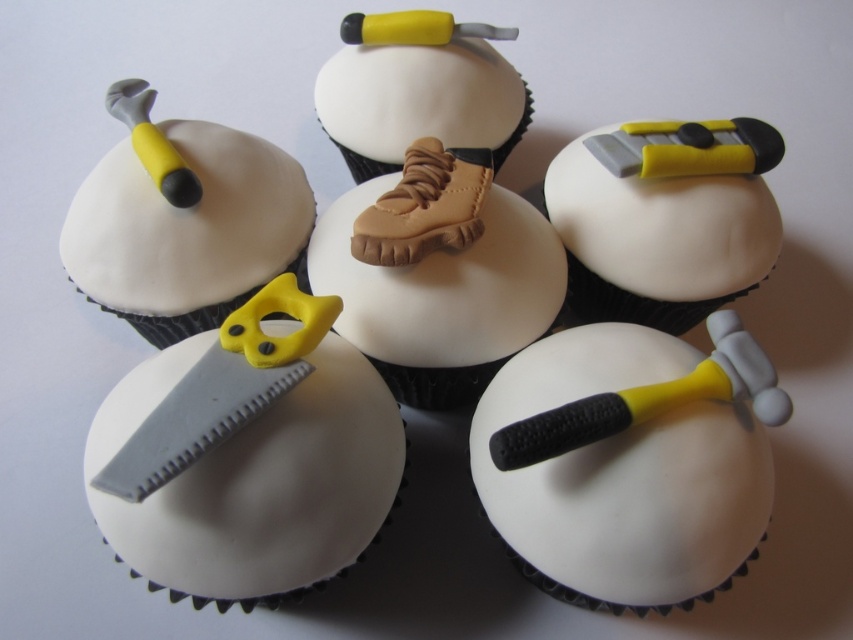
Question: Which object is positioned farthest from the gray matte saw at center?

Choices:
 (A) matte gray hammer at center
 (B) yellow matte hammer at lower right
 (C) matte white shoe at center

Answer: (A)

Question: Which point is farther from the camera taking this photo?

Choices:
 (A) (350, 524)
 (B) (113, 266)
 (C) (624, 384)

Answer: (B)

Question: Which of the following is the farthest from the observer?

Choices:
 (A) (392, 312)
 (B) (120, 280)

Answer: (B)

Question: Can you confirm if matte yellow plastic scissors at left is positioned to the right of matte white shoe at center?

Choices:
 (A) yes
 (B) no

Answer: (B)

Question: Is yellow matte hammer at lower right positioned in front of matte gray hammer at center?

Choices:
 (A) no
 (B) yes

Answer: (B)

Question: Can you confirm if yellow matte hammer at lower right is positioned below tan matte shoe at center?

Choices:
 (A) yes
 (B) no

Answer: (A)